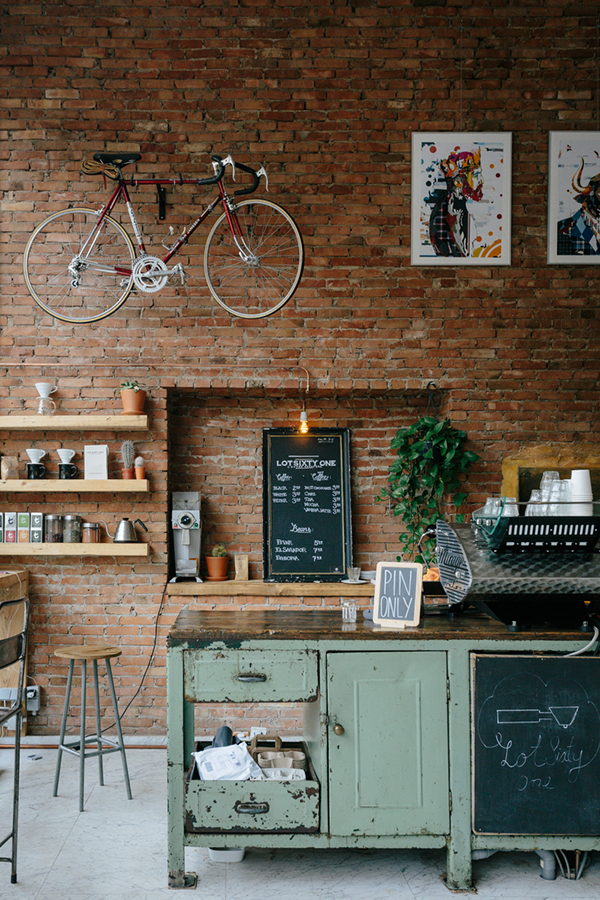
The width and height of the screenshot is (600, 900). What are the coordinates of `stools` in the screenshot? It's located at (14, 645), (95, 652).